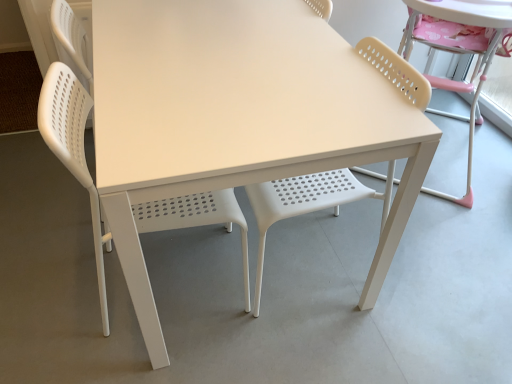
Find the location of a particular element. This screenshot has height=384, width=512. free location in front of white plastic chair at left, which ranks as the 1th chair in left-to-right order is located at coordinates (167, 360).